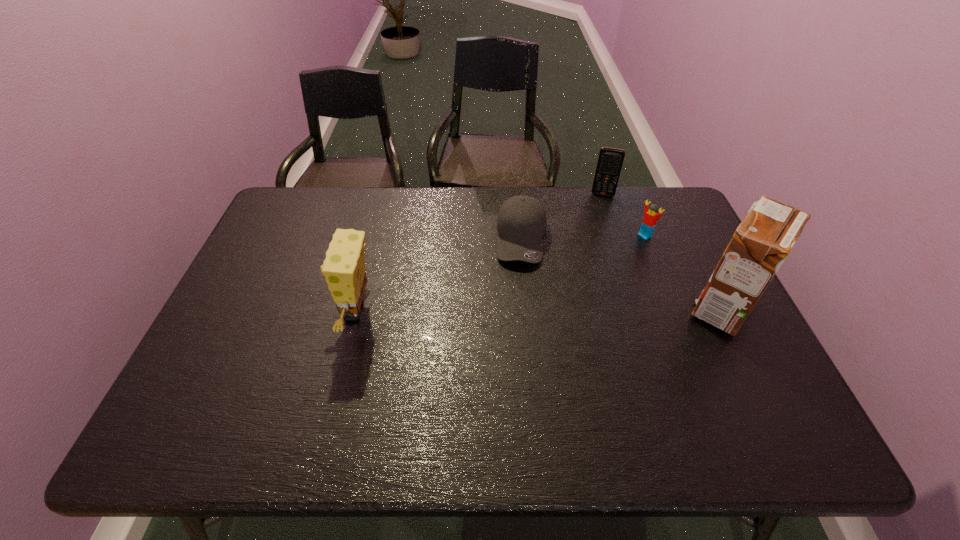
Where is `vacant area that lies between the second object from left to right and the tallest object`? The image size is (960, 540). vacant area that lies between the second object from left to right and the tallest object is located at coordinates (622, 273).

Where is `unoccupied area between the fourth shortest object and the fourth object from left to right`? This screenshot has height=540, width=960. unoccupied area between the fourth shortest object and the fourth object from left to right is located at coordinates (500, 274).

The height and width of the screenshot is (540, 960). I want to click on empty space that is in between the second tallest object and the third shortest object, so click(x=479, y=253).

The width and height of the screenshot is (960, 540). Identify the location of free point between the fourth object from right to left and the third shortest object. (563, 217).

Identify the location of free space between the fourth object from left to right and the cellular telephone. (624, 215).

Identify the location of the closest object to the farthest object. The width and height of the screenshot is (960, 540). (649, 221).

You are a GUI agent. You are given a task and a screenshot of the screen. Output one action in this format:
    pyautogui.click(x=<x>, y=<y>)
    Task: Click on the closest object to the rightmost object
    This screenshot has height=540, width=960.
    Given the screenshot: What is the action you would take?
    pyautogui.click(x=649, y=221)

The image size is (960, 540). I want to click on blank space that satisfies the following two spatial constraints: 1. on the back side of the fourth object from right to left; 2. on the right side of the cellular telephone, so click(517, 194).

At what (x,y) coordinates should I click in order to perform the action: click on free region that satisfies the following two spatial constraints: 1. on the front side of the carton; 2. on the straw side of the baseball cap. Please return your answer as a coordinate pair (x, y). This screenshot has width=960, height=540. Looking at the image, I should click on (x=529, y=308).